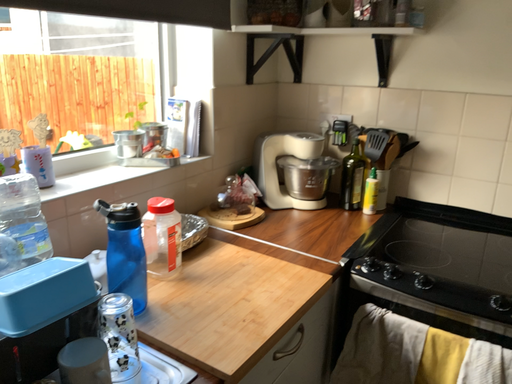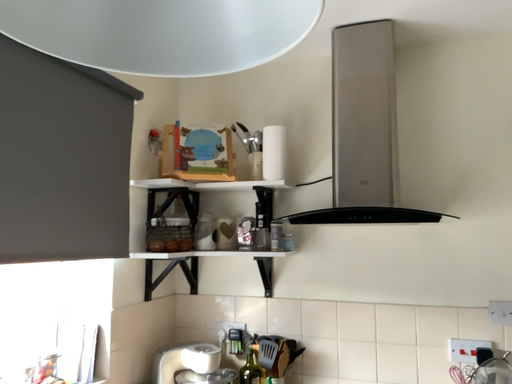
Question: Which way did the camera rotate in the video?

Choices:
 (A) rotated downward
 (B) rotated upward

Answer: (B)